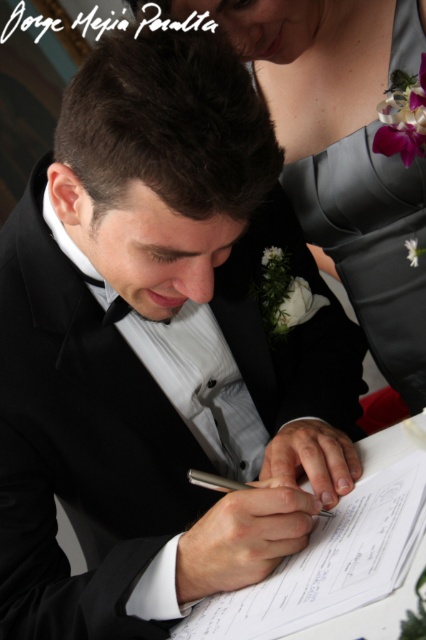
Can you confirm if satin gray dress at upper right is positioned to the right of metallic silver pen at center?

Correct, you'll find satin gray dress at upper right to the right of metallic silver pen at center.

Is point (331, 176) farther from camera compared to point (321, 513)?

Yes, point (331, 176) is farther from viewer.

Which is behind, point (305, 134) or point (206, 483)?

Positioned behind is point (305, 134).

Locate an element on the screen. satin gray dress at upper right is located at coordinates coord(345,150).